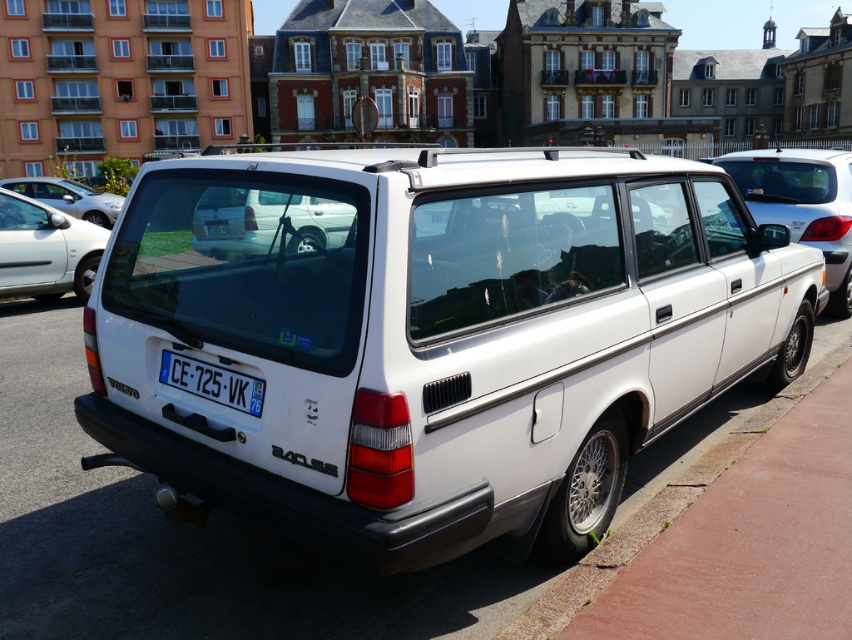
Question: Can you confirm if white matte station wagon at center is positioned to the left of white matte car at upper left?

Choices:
 (A) no
 (B) yes

Answer: (A)

Question: Where is white matte station wagon at center located in relation to white matte van at center in the image?

Choices:
 (A) left
 (B) right

Answer: (B)

Question: Estimate the real-world distances between objects in this image. Which object is closer to the white matte hatchback at upper left?

Choices:
 (A) white matte van at center
 (B) white matte car at upper left

Answer: (B)

Question: Does white matte station wagon at center have a lesser width compared to white matte car at upper left?

Choices:
 (A) yes
 (B) no

Answer: (B)

Question: Based on their relative distances, which object is farther from the white plastic license plate at center?

Choices:
 (A) white matte station wagon at center
 (B) white matte car at upper left
 (C) white matte van at center

Answer: (B)

Question: Which point appears farthest from the camera in this image?

Choices:
 (A) (220, 225)
 (B) (117, 204)
 (C) (677, 280)

Answer: (B)